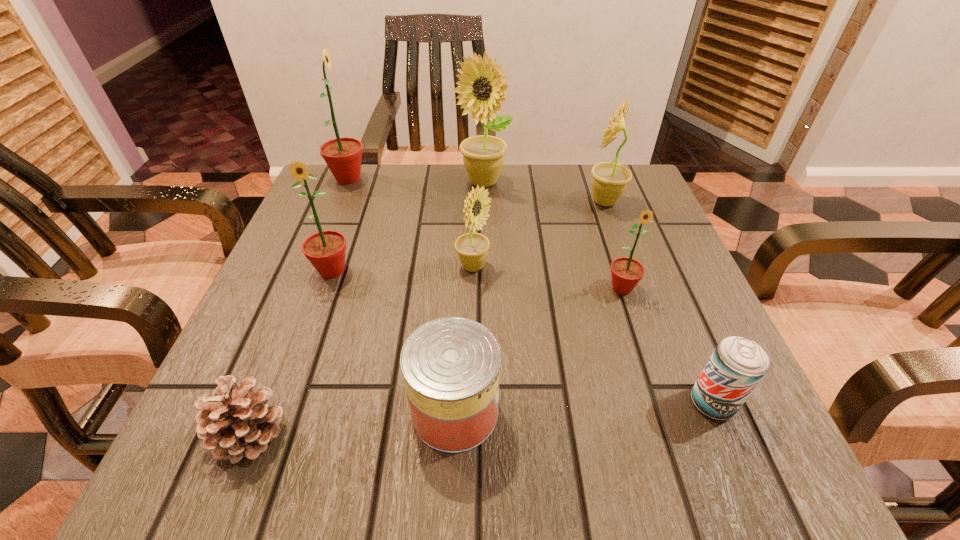
You are a GUI agent. You are given a task and a screenshot of the screen. Output one action in this format:
    pyautogui.click(x=<x>, y=<y>)
    Task: Click on the blank space that satisfies the following two spatial constraints: 1. on the face of the second biggest green sunflower; 2. on the left side of the beer can
    The image size is (960, 540).
    Given the screenshot: What is the action you would take?
    pyautogui.click(x=286, y=402)

Image resolution: width=960 pixels, height=540 pixels. I want to click on vacant area that satisfies the following two spatial constraints: 1. on the face of the biggest green sunflower; 2. on the left side of the can, so (x=255, y=411).

I want to click on vacant space that satisfies the following two spatial constraints: 1. on the face of the can; 2. on the left side of the second biggest green sunflower, so click(x=283, y=411).

Locate an element on the screen. free space that satisfies the following two spatial constraints: 1. on the face of the beer can; 2. on the right side of the second smallest green sunflower is located at coordinates (286, 402).

Find the location of a particular element. vacant space that satisfies the following two spatial constraints: 1. on the face of the brown pinecone; 2. on the right side of the farthest green sunflower is located at coordinates (247, 433).

At what (x,y) coordinates should I click in order to perform the action: click on vacant point that satisfies the following two spatial constraints: 1. on the face of the second smallest green sunflower; 2. on the left side of the can. Please return your answer as a coordinate pair (x, y). The height and width of the screenshot is (540, 960). Looking at the image, I should click on (283, 411).

The width and height of the screenshot is (960, 540). I want to click on free point that satisfies the following two spatial constraints: 1. on the face of the biggest green sunflower; 2. on the left side of the beer can, so click(258, 402).

Identify the location of vacant point that satisfies the following two spatial constraints: 1. on the face of the rightmost yellow sunflower; 2. on the front side of the brown pinecone. (686, 433).